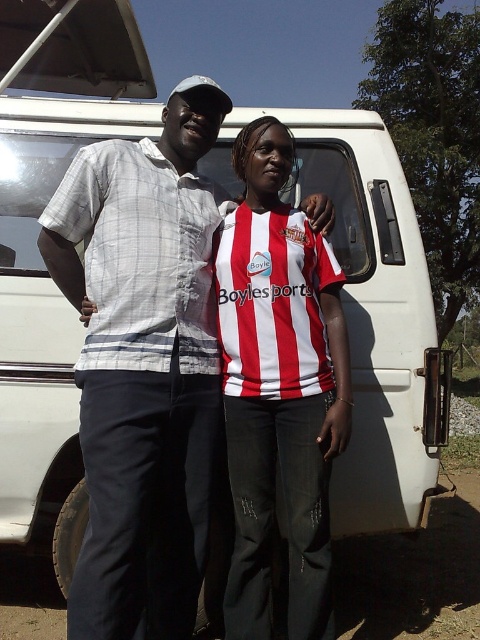
You are standing 5 feet away from the white checkered shirt at center. If you want to take a photo of it, will you be able to capture the entire shirt in the frame without moving closer?

The white checkered shirt at center is 6.31 feet away from the camera. Since you are standing 5 feet away from it, you are closer than the camera. Therefore, you might be able to capture the entire shirt in the frame without moving closer, depending on your camera lens and zoom settings.

You are a photographer trying to capture both the white checkered shirt at center and the red and white striped shirt at center in a single frame. Since you want to ensure both are visible, which shirt should you adjust your focus on to account for their sizes?

The white checkered shirt at center is larger in size compared to the red and white striped shirt at center, so you should focus on the red and white striped shirt at center to ensure its details are clear while the larger white checkered shirt at center remains in the frame.

You are standing in front of a white van and want to place a small flag at the point that is closer to the van. Which point should you choose between point (203, 524) and point (259, 154)?

Point (203, 524) is in front of point (259, 154), so it is closer to the van. You should place the flag at point (203, 524).